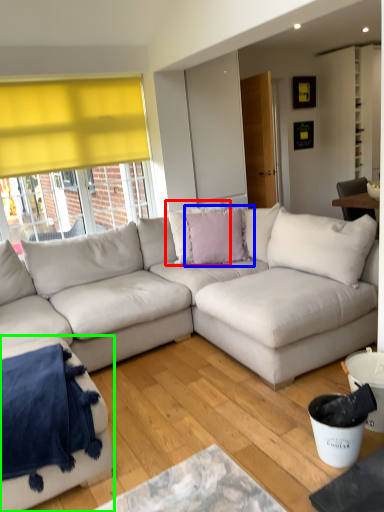
Question: Considering the real-world distances, which object is farthest from pillow (highlighted by a red box)? pillow (highlighted by a blue box) or studio couch (highlighted by a green box)?

Choices:
 (A) pillow
 (B) studio couch

Answer: (B)